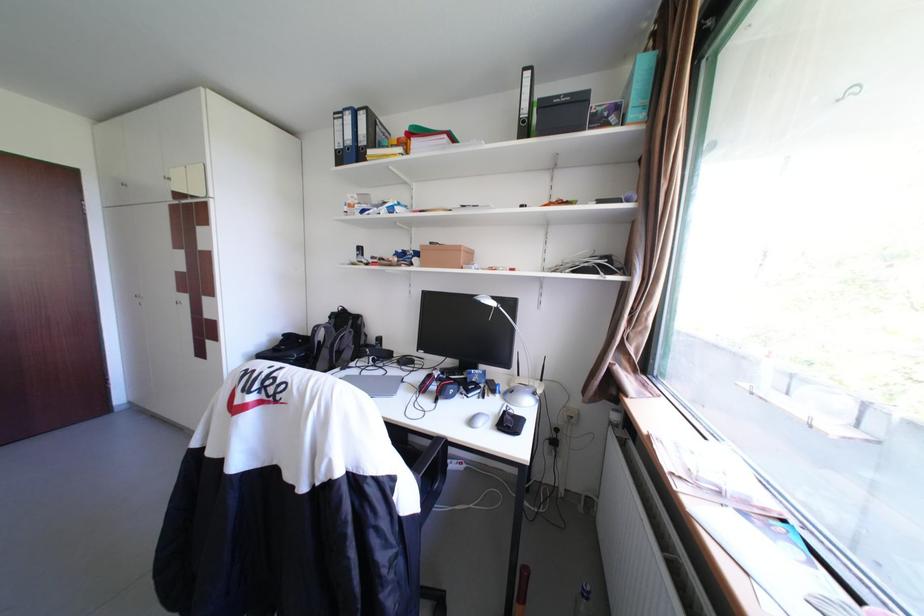
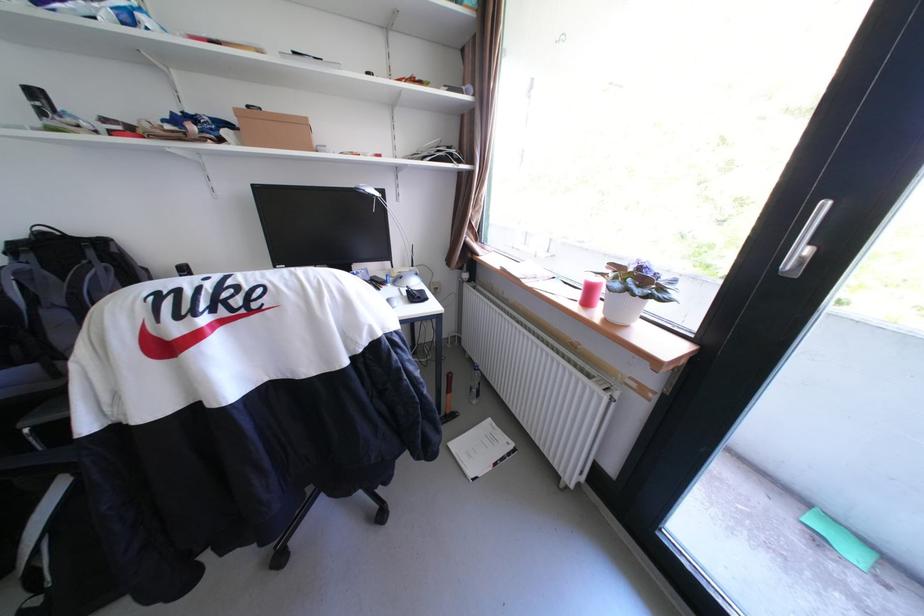
Question: I am providing you with two images of the same scene from different viewpoints. Which of the following objects are not visible in image2?

Choices:
 (A) hammer
 (B) white paper booklet
 (C) desk lamp head
 (D) none of these

Answer: (D)